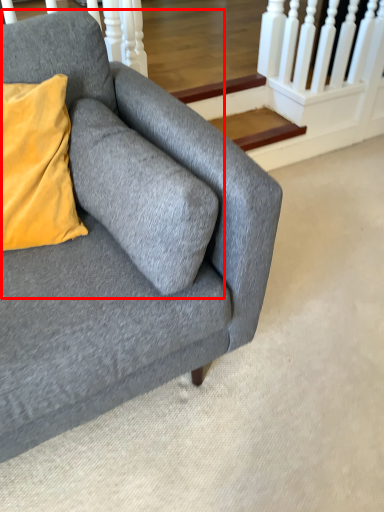
Question: Considering the relative positions of swivel chair (annotated by the red box) and studio couch in the image provided, where is swivel chair (annotated by the red box) located with respect to the staircase?

Choices:
 (A) right
 (B) left

Answer: (B)